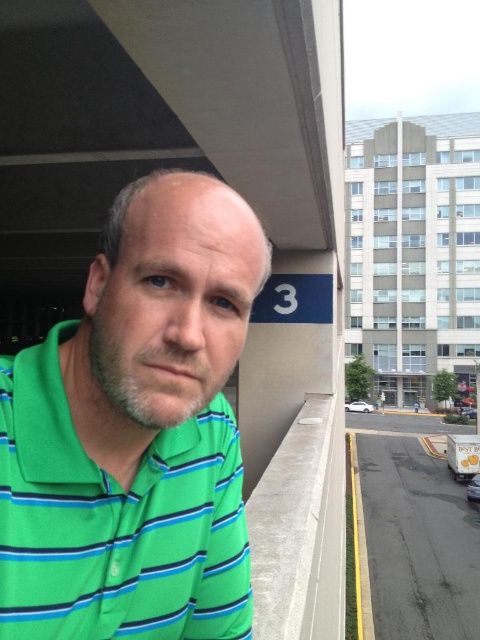
You are a delivery driver who needs to park your vehicle between the white glossy van at lower right and the white matte car at lower right. The parking spot between them is exactly 2 meters long. Can your truck, which is 1.8 meters long, fit into this space?

The parking spot between the white glossy van at lower right and the white matte car at lower right is exactly 2 meters long. Since your truck is 1.8 meters long, it can fit into the space.

You are a photographer trying to capture a clear shot of the green striped polo shirt at left and the white glossy van at lower right. Since you want both subjects in focus, which one should you adjust your camera focus on first?

The green striped polo shirt at left is closer to the viewer than the white glossy van at lower right, so you should focus on the green striped polo shirt at left first to ensure both are in focus.

You are driving a car and want to exit the parking garage. You see the white glossy van at lower right and the white matte car at lower right blocking your path. Which vehicle should you move first to clear the path?

The white glossy van at lower right is in front of the white matte car at lower right, so you should move the white glossy van at lower right first to clear the path.